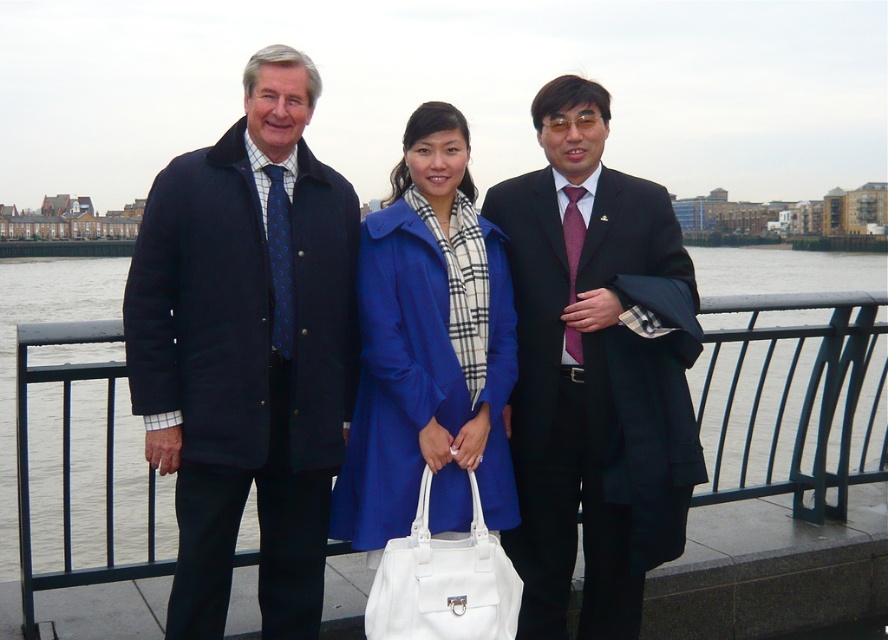
Question: Which point is farther to the camera?

Choices:
 (A) (803, 252)
 (B) (513, 346)
 (C) (472, 496)

Answer: (A)

Question: Is matte black water at center closer to camera compared to white leather handbag at center?

Choices:
 (A) yes
 (B) no

Answer: (B)

Question: Can you confirm if navy wool coat at left is positioned above matte black water at center?

Choices:
 (A) no
 (B) yes

Answer: (A)

Question: Based on their relative distances, which object is nearer to the matte blue coat at center?

Choices:
 (A) matte black coat at center
 (B) matte black suit at center

Answer: (A)

Question: Is matte black coat at center above matte blue coat at center?

Choices:
 (A) no
 (B) yes

Answer: (B)

Question: Which point is closer to the camera?

Choices:
 (A) navy wool coat at left
 (B) matte black suit at center

Answer: (A)